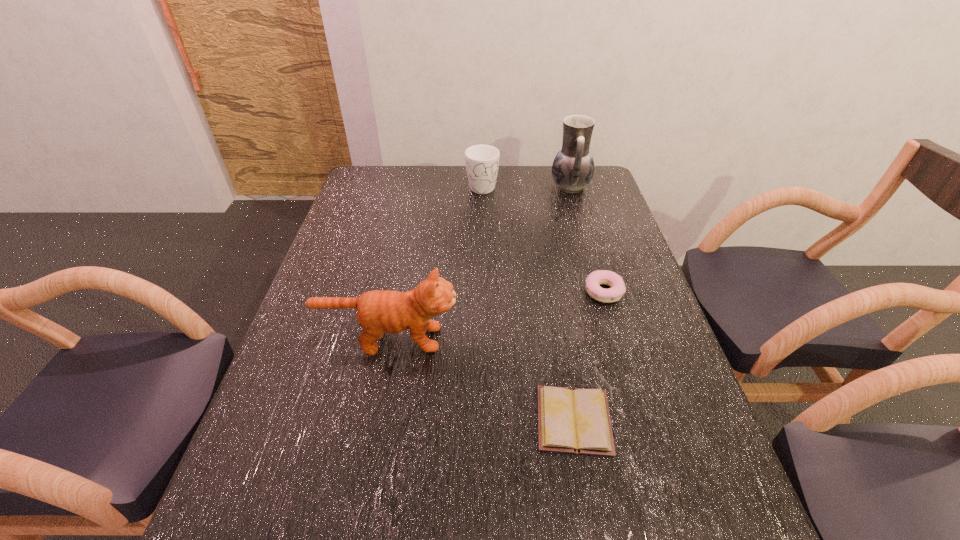
Where is `doughnut at the right edge`? doughnut at the right edge is located at coordinates (593, 281).

I want to click on object at the far right corner, so click(573, 167).

Identify the location of vacant space at the far edge of the desktop. (399, 192).

Find the location of a particular element. free spot at the left edge of the desktop is located at coordinates pyautogui.click(x=268, y=515).

Locate an element on the screen. The height and width of the screenshot is (540, 960). vacant space at the right edge of the desktop is located at coordinates (634, 405).

Where is `free space at the far left corner`? free space at the far left corner is located at coordinates (386, 175).

I want to click on vacant space in between the nearest object and the third nearest object, so click(x=588, y=356).

At what (x,y) coordinates should I click in order to perform the action: click on blank region between the second shortest object and the second tallest object. Please return your answer as a coordinate pair (x, y). The width and height of the screenshot is (960, 540). Looking at the image, I should click on (496, 315).

Identify the location of vacant space that's between the third tallest object and the cat. The image size is (960, 540). (435, 262).

Find the location of a particular element. unoccupied position between the nearest object and the third nearest object is located at coordinates (588, 356).